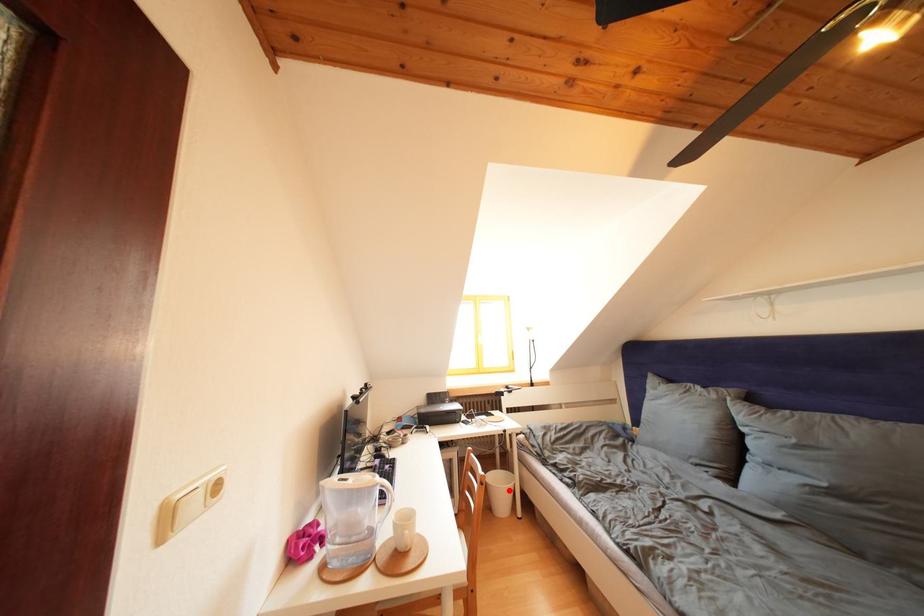
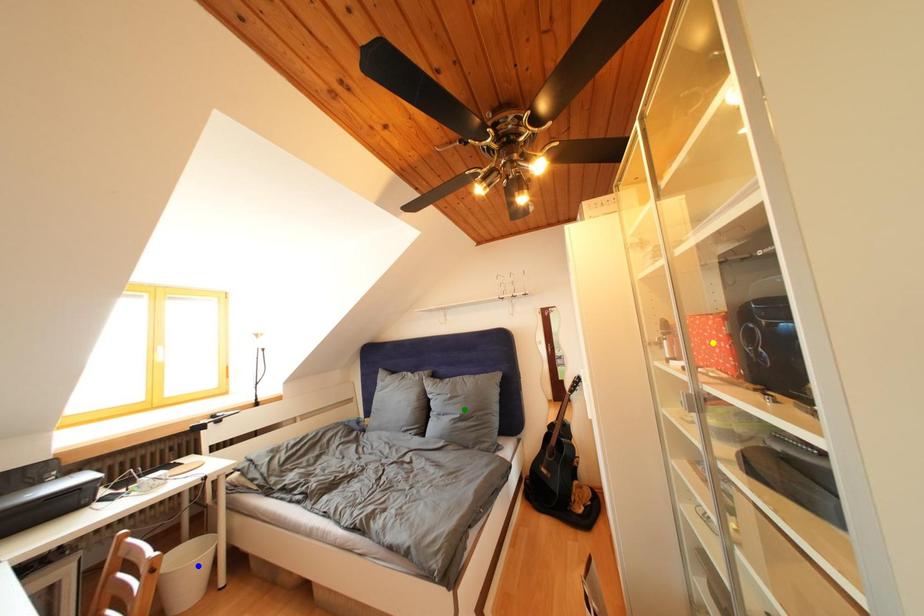
Question: I am providing you with two images of the same scene from different viewpoints. A red point is marked on the first image. You are given multiple points on the second image. Which point in image 2 is actually the same real-world point as the red point in image 1?

Choices:
 (A) blue point
 (B) yellow point
 (C) green point

Answer: (A)